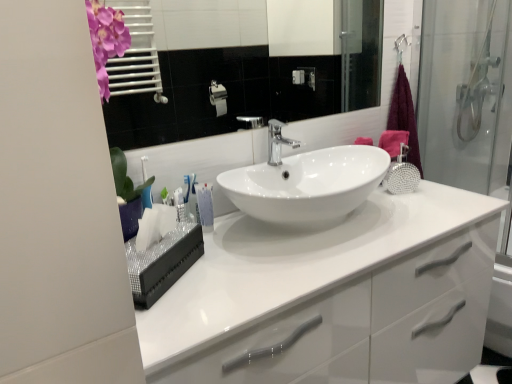
The height and width of the screenshot is (384, 512). What are the coordinates of `free space above white glossy cabinet at center (from a real-world perspective)` in the screenshot? It's located at (317, 240).